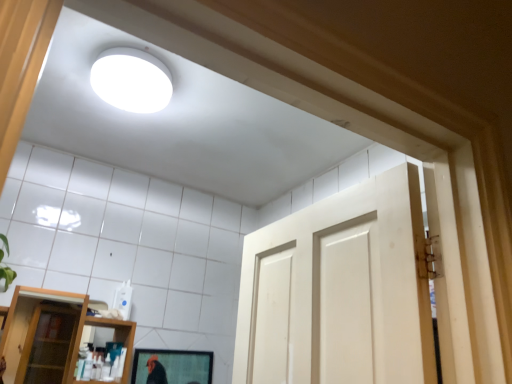
Question: Could you tell me if transparent glass shelf at lower left is turned towards matte black mirror at lower center?

Choices:
 (A) yes
 (B) no

Answer: (B)

Question: Considering the relative positions of transparent glass shelf at lower left and matte black mirror at lower center in the image provided, is transparent glass shelf at lower left to the left of matte black mirror at lower center from the viewer's perspective?

Choices:
 (A) no
 (B) yes

Answer: (B)

Question: Can you confirm if transparent glass shelf at lower left is wider than matte black mirror at lower center?

Choices:
 (A) no
 (B) yes

Answer: (B)

Question: Is transparent glass shelf at lower left not within matte black mirror at lower center?

Choices:
 (A) yes
 (B) no

Answer: (A)

Question: From a real-world perspective, is transparent glass shelf at lower left positioned over matte black mirror at lower center based on gravity?

Choices:
 (A) no
 (B) yes

Answer: (B)

Question: Is transparent glass shelf at lower left in front of or behind matte black mirror at lower center in the image?

Choices:
 (A) front
 (B) behind

Answer: (A)

Question: Is transparent glass shelf at lower left to the left or to the right of matte black mirror at lower center in the image?

Choices:
 (A) right
 (B) left

Answer: (B)

Question: Considering the positions of transparent glass shelf at lower left and matte black mirror at lower center in the image, is transparent glass shelf at lower left bigger or smaller than matte black mirror at lower center?

Choices:
 (A) small
 (B) big

Answer: (B)

Question: Considering the positions of point (81, 316) and point (184, 372), is point (81, 316) closer or farther from the camera than point (184, 372)?

Choices:
 (A) farther
 (B) closer

Answer: (B)

Question: Would you say matte black mirror at lower center is to the left or to the right of transparent glass shelf at lower left in the picture?

Choices:
 (A) left
 (B) right

Answer: (B)

Question: In the image, is matte black mirror at lower center positioned in front of or behind transparent glass shelf at lower left?

Choices:
 (A) front
 (B) behind

Answer: (B)

Question: Considering the positions of point (165, 377) and point (73, 307), is point (165, 377) closer or farther from the camera than point (73, 307)?

Choices:
 (A) farther
 (B) closer

Answer: (B)

Question: Looking at the image, does matte black mirror at lower center seem bigger or smaller compared to transparent glass shelf at lower left?

Choices:
 (A) small
 (B) big

Answer: (A)

Question: Looking at the image, does transparent glass shelf at lower left seem bigger or smaller compared to white matte light fixture at upper center?

Choices:
 (A) big
 (B) small

Answer: (A)

Question: From a real-world perspective, is transparent glass shelf at lower left above or below white matte light fixture at upper center?

Choices:
 (A) below
 (B) above

Answer: (A)